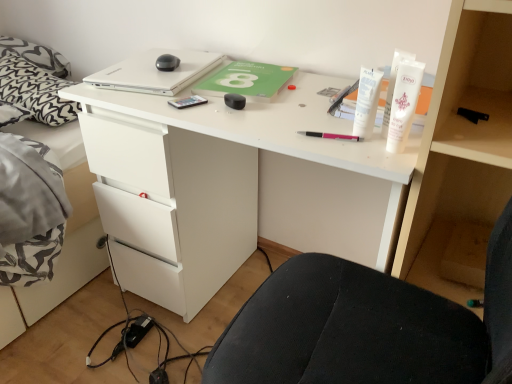
Image resolution: width=512 pixels, height=384 pixels. Find the location of `vacant area on top of white matte laptop at upper center (from a real-world perspective)`. vacant area on top of white matte laptop at upper center (from a real-world perspective) is located at coordinates (143, 69).